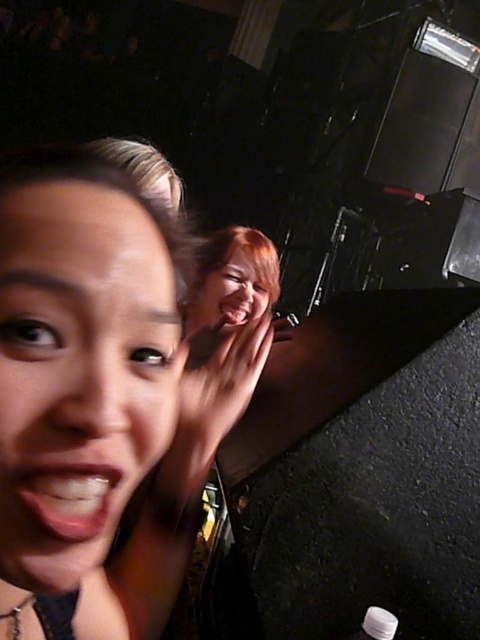
Is matte skin face at left behind white matte bottle at lower right?

No.

Can you confirm if matte skin face at left is bigger than white matte bottle at lower right?

Correct, matte skin face at left is larger in size than white matte bottle at lower right.

Between point (73, 356) and point (395, 632), which one is positioned behind?

The point (395, 632) is more distant.

Find the location of `matte skin face at left`. matte skin face at left is located at coordinates [x=79, y=372].

Locate an element on the screen. The image size is (480, 640). matte skin face at left is located at coordinates (79, 372).

Is matte skin face at left wider than smooth skin face at upper center?

Incorrect, matte skin face at left's width does not surpass smooth skin face at upper center's.

This screenshot has width=480, height=640. What do you see at coordinates (79, 372) in the screenshot?
I see `matte skin face at left` at bounding box center [79, 372].

Identify the location of matte skin face at left. (79, 372).

Between point (255, 276) and point (371, 620), which one is positioned behind?

The point (255, 276) is behind.

Does smooth skin face at upper center have a lesser width compared to white matte bottle at lower right?

In fact, smooth skin face at upper center might be wider than white matte bottle at lower right.

Identify the location of smooth skin face at upper center. This screenshot has width=480, height=640. (232, 291).

This screenshot has height=640, width=480. What are the coordinates of `smooth skin face at upper center` in the screenshot? It's located at (232, 291).